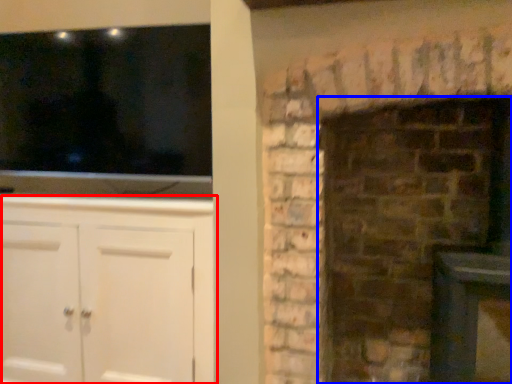
Question: Which point is further to the camera, cabinetry (highlighted by a red box) or fireplace (highlighted by a blue box)?

Choices:
 (A) cabinetry
 (B) fireplace

Answer: (A)